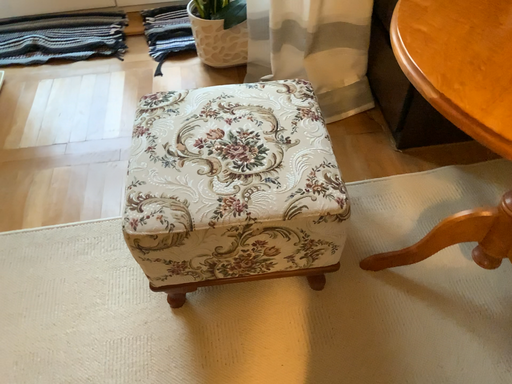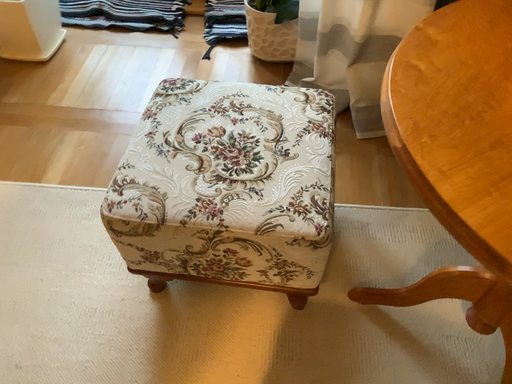
Question: How did the camera likely rotate when shooting the video?

Choices:
 (A) rotated right
 (B) rotated left

Answer: (B)